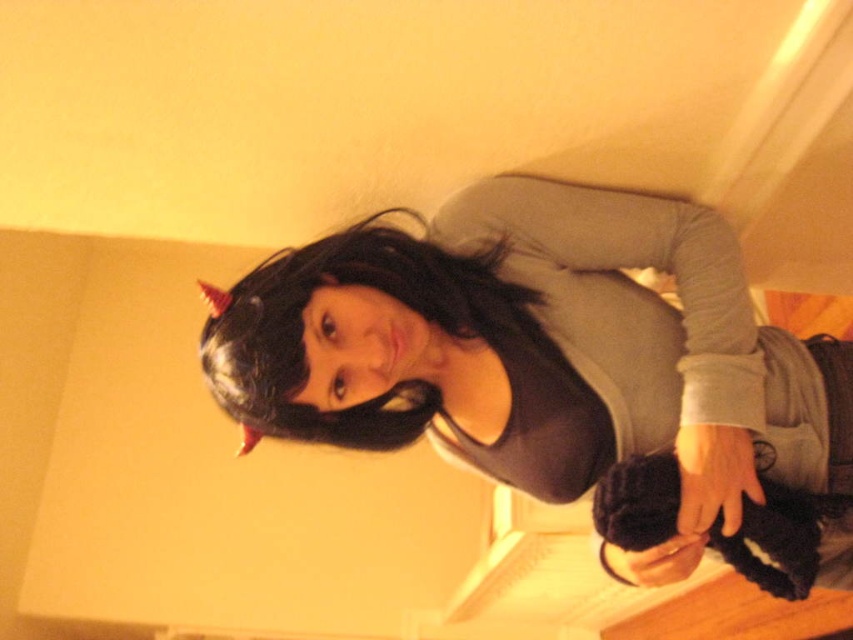
Locate an element on the screen. black matte wig at upper center is located at coordinates (538, 353).

Between black matte wig at upper center and black matte hair at upper center, which one appears on the left side from the viewer's perspective?

From the viewer's perspective, black matte hair at upper center appears more on the left side.

The width and height of the screenshot is (853, 640). I want to click on black matte wig at upper center, so click(538, 353).

Find the location of a particular element. black matte wig at upper center is located at coordinates coord(538,353).

Is black matte wig at upper center to the left of gray matte shirt at upper center from the viewer's perspective?

Indeed, black matte wig at upper center is positioned on the left side of gray matte shirt at upper center.

What do you see at coordinates (538, 353) in the screenshot?
I see `black matte wig at upper center` at bounding box center [538, 353].

Does point (532, 484) come closer to viewer compared to point (656, 428)?

No.

The height and width of the screenshot is (640, 853). I want to click on black matte wig at upper center, so click(x=538, y=353).

Does gray matte shirt at upper center have a lesser height compared to black matte hair at upper center?

Incorrect, gray matte shirt at upper center's height does not fall short of black matte hair at upper center's.

Can you confirm if gray matte shirt at upper center is positioned to the left of black matte hair at upper center?

In fact, gray matte shirt at upper center is to the right of black matte hair at upper center.

The width and height of the screenshot is (853, 640). Find the location of `gray matte shirt at upper center`. gray matte shirt at upper center is located at coordinates (625, 339).